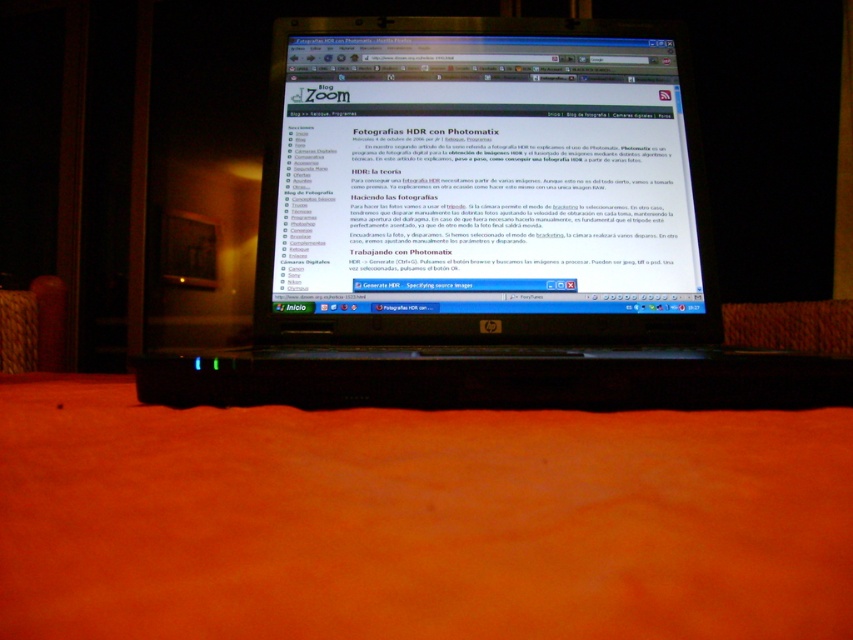
Can you confirm if black plastic laptop at center is thinner than matte black monitor at center?

In fact, black plastic laptop at center might be wider than matte black monitor at center.

Is point (641, 170) more distant than point (606, 148)?

Yes, point (641, 170) is behind point (606, 148).

Where is `black plastic laptop at center`? Image resolution: width=853 pixels, height=640 pixels. black plastic laptop at center is located at coordinates (485, 228).

Find the location of a particular element. The width and height of the screenshot is (853, 640). black plastic laptop at center is located at coordinates (485, 228).